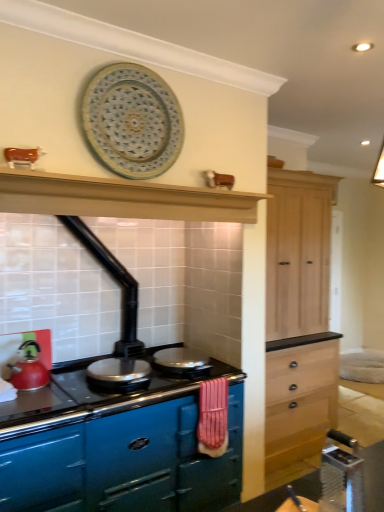
Measure the distance between glossy enamel stove at center and camera.

1.77 meters.

The width and height of the screenshot is (384, 512). Identify the location of blue ceramic platter at upper center. (132, 121).

Find the location of `shiny silver pan at center, the 2th appliance when ordered from left to right`. shiny silver pan at center, the 2th appliance when ordered from left to right is located at coordinates (181, 361).

This screenshot has height=512, width=384. What do you see at coordinates (352, 480) in the screenshot?
I see `metallic silver table at lower right` at bounding box center [352, 480].

What do you see at coordinates (119, 374) in the screenshot? The height and width of the screenshot is (512, 384). I see `shiny metallic pan at center, the 1th appliance viewed from the left` at bounding box center [119, 374].

The height and width of the screenshot is (512, 384). In order to click on glossy enamel stove at center in this screenshot , I will do `click(124, 463)`.

Does shiny metallic pan at center, which is the 2th appliance in right-to-left order, turn towards shiny silver pan at center, marked as the 1th appliance in a right-to-left arrangement?

No, shiny metallic pan at center, which is the 2th appliance in right-to-left order, is not oriented towards shiny silver pan at center, marked as the 1th appliance in a right-to-left arrangement.

Are shiny metallic pan at center, the 1th appliance viewed from the left, and shiny silver pan at center, the 2th appliance when ordered from left to right, beside each other?

shiny metallic pan at center, the 1th appliance viewed from the left, and shiny silver pan at center, the 2th appliance when ordered from left to right, are clearly separated.

You are a GUI agent. You are given a task and a screenshot of the screen. Output one action in this format:
    pyautogui.click(x=<x>, y=<y>)
    Task: Click on the appliance located above the shiny metallic pan at center, the 1th appliance viewed from the left (from the image's perspective)
    
    Given the screenshot: What is the action you would take?
    pyautogui.click(x=181, y=361)

From a real-world perspective, is shiny metallic pan at center, which is the 2th appliance in right-to-left order, physically located above or below shiny silver pan at center, the 2th appliance when ordered from left to right?

Clearly, from a real-world perspective, shiny metallic pan at center, which is the 2th appliance in right-to-left order, is below shiny silver pan at center, the 2th appliance when ordered from left to right.

Who is bigger, blue ceramic platter at upper center or shiny silver pan at center, the 2th appliance when ordered from left to right?

blue ceramic platter at upper center.

Is blue ceramic platter at upper center aimed at shiny silver pan at center, marked as the 1th appliance in a right-to-left arrangement?

No, blue ceramic platter at upper center is not turned towards shiny silver pan at center, marked as the 1th appliance in a right-to-left arrangement.

Does blue ceramic platter at upper center appear on the right side of shiny silver pan at center, the 2th appliance when ordered from left to right?

In fact, blue ceramic platter at upper center is to the left of shiny silver pan at center, the 2th appliance when ordered from left to right.

Could you measure the distance between blue ceramic platter at upper center and shiny silver pan at center, the 2th appliance when ordered from left to right?

4.55 feet.

Between blue ceramic platter at upper center and matte black exhaust hood at upper center, which one is positioned in front?

Positioned in front is matte black exhaust hood at upper center.

Is blue ceramic platter at upper center inside or outside of matte black exhaust hood at upper center?

blue ceramic platter at upper center cannot be found inside matte black exhaust hood at upper center.

Is blue ceramic platter at upper center oriented towards matte black exhaust hood at upper center?

No, blue ceramic platter at upper center is not oriented towards matte black exhaust hood at upper center.

Does blue ceramic platter at upper center appear on the left side of matte black exhaust hood at upper center?

Yes, blue ceramic platter at upper center is to the left of matte black exhaust hood at upper center.

Would you say shiny metallic pan at center, the 1th appliance viewed from the left, is to the left or to the right of metallic silver table at lower right in the picture?

shiny metallic pan at center, the 1th appliance viewed from the left, is to the left of metallic silver table at lower right.

Can you confirm if shiny metallic pan at center, which is the 2th appliance in right-to-left order, is wider than metallic silver table at lower right?

Indeed, shiny metallic pan at center, which is the 2th appliance in right-to-left order, has a greater width compared to metallic silver table at lower right.

Does point (125, 386) lie in front of point (380, 442)?

No, it is behind (380, 442).

In terms of width, does matte black exhaust hood at upper center look wider or thinner when compared to shiny metallic pan at center, the 1th appliance viewed from the left?

Considering their sizes, matte black exhaust hood at upper center looks slimmer than shiny metallic pan at center, the 1th appliance viewed from the left.

From a real-world perspective, is matte black exhaust hood at upper center above or below shiny metallic pan at center, the 1th appliance viewed from the left?

matte black exhaust hood at upper center is above shiny metallic pan at center, the 1th appliance viewed from the left.

Locate an element on the screen. Image resolution: width=384 pixels, height=512 pixels. exhaust hood lying on the right of shiny metallic pan at center, which is the 2th appliance in right-to-left order is located at coordinates (121, 198).

Which is farther from the camera, (248, 218) or (147, 374)?

The point (147, 374) is farther from the camera.

From a real-world perspective, does glossy enamel stove at center stand above metallic silver table at lower right?

Incorrect, from a real-world perspective, glossy enamel stove at center is lower than metallic silver table at lower right.

In the scene shown: From the image's perspective, which is below, glossy enamel stove at center or metallic silver table at lower right?

glossy enamel stove at center, from the image's perspective.

How distant is glossy enamel stove at center from metallic silver table at lower right?

1.10 meters.

Is point (140, 446) positioned behind point (370, 475)?

Yes, point (140, 446) is farther from viewer.

Considering the positions of objects shiny silver pan at center, the 2th appliance when ordered from left to right, and blue ceramic platter at upper center in the image provided, who is more to the right, shiny silver pan at center, the 2th appliance when ordered from left to right, or blue ceramic platter at upper center?

shiny silver pan at center, the 2th appliance when ordered from left to right, is more to the right.

Where is `platter in front of the shiny silver pan at center, the 2th appliance when ordered from left to right`? The height and width of the screenshot is (512, 384). platter in front of the shiny silver pan at center, the 2th appliance when ordered from left to right is located at coordinates (132, 121).

Where is `appliance that is under the shiny silver pan at center, the 2th appliance when ordered from left to right (from a real-world perspective)`? The width and height of the screenshot is (384, 512). appliance that is under the shiny silver pan at center, the 2th appliance when ordered from left to right (from a real-world perspective) is located at coordinates (119, 374).

Locate an element on the screen. The height and width of the screenshot is (512, 384). platter on the left of the shiny silver pan at center, the 2th appliance when ordered from left to right is located at coordinates (132, 121).

From the image, which object appears to be nearer to matte red kettle at left, blue ceramic platter at upper center or metallic silver table at lower right?

blue ceramic platter at upper center is closer to matte red kettle at left.

Based on their spatial positions, is metallic silver table at lower right or glossy enamel stove at center further from shiny silver pan at center, the 2th appliance when ordered from left to right?

metallic silver table at lower right lies further to shiny silver pan at center, the 2th appliance when ordered from left to right, than the other object.

Based on their spatial positions, is metallic silver table at lower right or shiny silver pan at center, marked as the 1th appliance in a right-to-left arrangement, closer to blue ceramic platter at upper center?

Among the two, shiny silver pan at center, marked as the 1th appliance in a right-to-left arrangement, is located nearer to blue ceramic platter at upper center.

When comparing their distances from shiny metallic pan at center, the 1th appliance viewed from the left, does glossy enamel stove at center or matte red kettle at left seem further?

glossy enamel stove at center is further to shiny metallic pan at center, the 1th appliance viewed from the left.

Estimate the real-world distances between objects in this image. Which object is further from shiny metallic pan at center, which is the 2th appliance in right-to-left order, matte black exhaust hood at upper center or matte red kettle at left?

The object further to shiny metallic pan at center, which is the 2th appliance in right-to-left order, is matte black exhaust hood at upper center.

Based on their spatial positions, is metallic silver table at lower right or shiny silver pan at center, the 2th appliance when ordered from left to right, further from shiny metallic pan at center, the 1th appliance viewed from the left?

metallic silver table at lower right is further to shiny metallic pan at center, the 1th appliance viewed from the left.

When comparing their distances from matte black exhaust hood at upper center, does glossy enamel stove at center or blue ceramic platter at upper center seem further?

glossy enamel stove at center.

Considering their positions, is shiny silver pan at center, marked as the 1th appliance in a right-to-left arrangement, positioned further to glossy enamel stove at center than blue ceramic platter at upper center?

blue ceramic platter at upper center is positioned further to the anchor glossy enamel stove at center.

Where is `exhaust hood that lies between blue ceramic platter at upper center and shiny metallic pan at center, which is the 2th appliance in right-to-left order, from top to bottom`? exhaust hood that lies between blue ceramic platter at upper center and shiny metallic pan at center, which is the 2th appliance in right-to-left order, from top to bottom is located at coordinates (121, 198).

You are a GUI agent. You are given a task and a screenshot of the screen. Output one action in this format:
    pyautogui.click(x=<x>, y=<y>)
    Task: Click on the kitchen appliance between blue ceramic platter at upper center and glossy enamel stove at center vertically
    
    Given the screenshot: What is the action you would take?
    pyautogui.click(x=29, y=369)

In order to click on appliance positioned between glossy enamel stove at center and shiny silver pan at center, marked as the 1th appliance in a right-to-left arrangement, from near to far in this screenshot , I will do `click(119, 374)`.

You are a GUI agent. You are given a task and a screenshot of the screen. Output one action in this format:
    pyautogui.click(x=<x>, y=<y>)
    Task: Click on the appliance between metallic silver table at lower right and shiny silver pan at center, marked as the 1th appliance in a right-to-left arrangement, in the front-back direction
    The height and width of the screenshot is (512, 384).
    Given the screenshot: What is the action you would take?
    pyautogui.click(x=119, y=374)